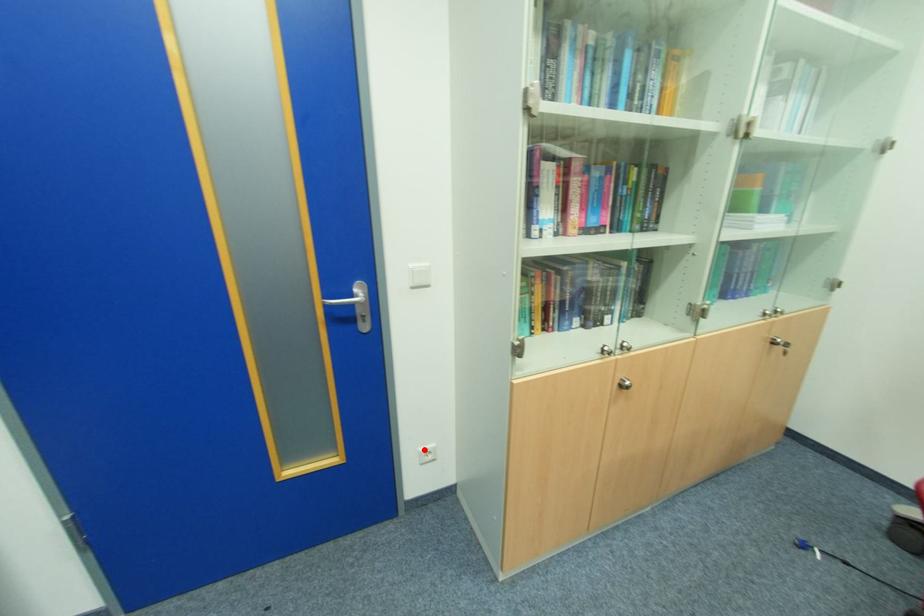
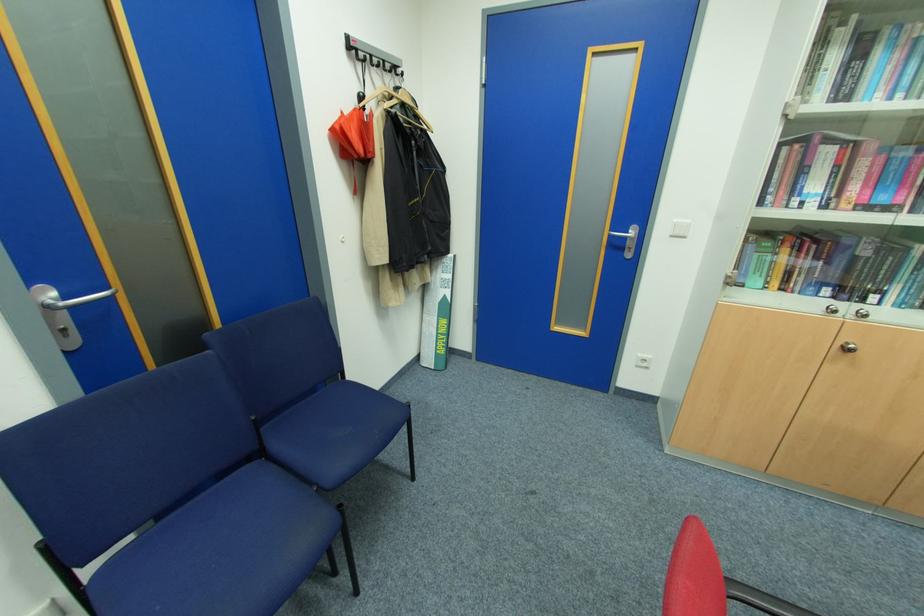
The point at the highlighted location is marked in the first image. Where is the corresponding point in the second image?

(642, 355)